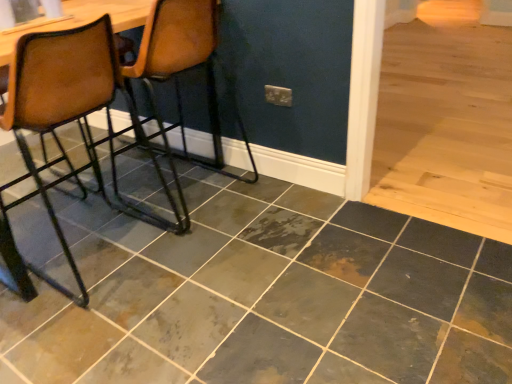
Question: Is brown leather chair at left, the first chair from the right, at the back of brown leather chair at left, which is counted as the 1th chair, starting from the left?

Choices:
 (A) yes
 (B) no

Answer: (B)

Question: From the image's perspective, is brown leather chair at left, which is counted as the 1th chair, starting from the left, located above brown leather chair at left, the first chair from the right?

Choices:
 (A) yes
 (B) no

Answer: (B)

Question: Is brown leather chair at left, which is counted as the 1th chair, starting from the left, far from brown leather chair at left, which is counted as the 2th chair, starting from the left?

Choices:
 (A) no
 (B) yes

Answer: (A)

Question: Is brown leather chair at left, which is counted as the 1th chair, starting from the left, in front of brown leather chair at left, the first chair from the right?

Choices:
 (A) no
 (B) yes

Answer: (B)

Question: Is brown leather chair at left, which is counted as the 1th chair, starting from the left, shorter than brown leather chair at left, which is counted as the 2th chair, starting from the left?

Choices:
 (A) no
 (B) yes

Answer: (B)

Question: Is brown leather chair at left, which is counted as the 1th chair, starting from the left, beside brown leather chair at left, which is counted as the 2th chair, starting from the left?

Choices:
 (A) yes
 (B) no

Answer: (B)

Question: Is marbled slate tile at center directly adjacent to brown leather chair at left, which is counted as the 1th chair, starting from the left?

Choices:
 (A) no
 (B) yes

Answer: (A)

Question: From the image's perspective, would you say marbled slate tile at center is positioned over brown leather chair at left, which is counted as the 1th chair, starting from the left?

Choices:
 (A) no
 (B) yes

Answer: (A)

Question: From the image's perspective, is marbled slate tile at center under brown leather chair at left, which is counted as the 1th chair, starting from the left?

Choices:
 (A) yes
 (B) no

Answer: (A)

Question: Can you confirm if marbled slate tile at center is positioned to the right of brown leather chair at left, which is counted as the 1th chair, starting from the left?

Choices:
 (A) no
 (B) yes

Answer: (B)

Question: Does marbled slate tile at center have a lesser width compared to brown leather chair at left, arranged as the 2th chair when viewed from the right?

Choices:
 (A) no
 (B) yes

Answer: (A)

Question: Would you consider marbled slate tile at center to be distant from brown leather chair at left, arranged as the 2th chair when viewed from the right?

Choices:
 (A) no
 (B) yes

Answer: (A)

Question: Is brown leather chair at left, which is counted as the 2th chair, starting from the left, completely or partially outside of marbled slate tile at center?

Choices:
 (A) no
 (B) yes

Answer: (B)